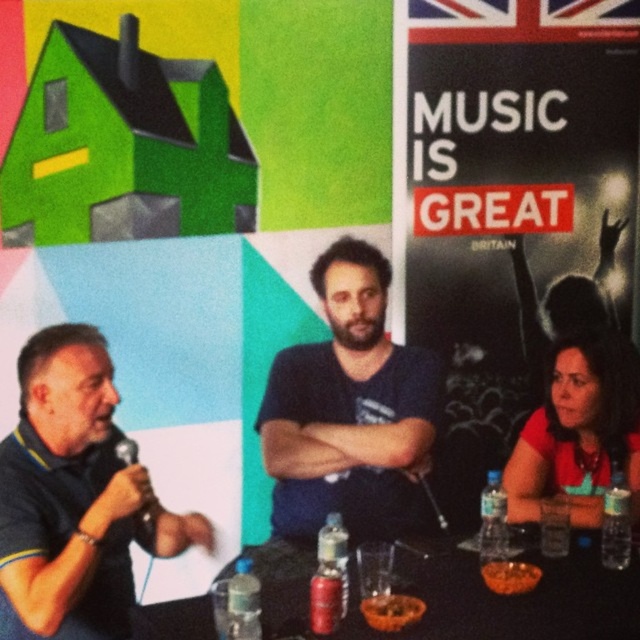
Is dark blue t-shirt at center bigger than black plastic table at lower center?

Yes, dark blue t-shirt at center is bigger than black plastic table at lower center.

Can you confirm if dark blue t-shirt at center is smaller than black plastic table at lower center?

Incorrect, dark blue t-shirt at center is not smaller in size than black plastic table at lower center.

In order to click on dark blue t-shirt at center in this screenshot , I will do `click(349, 410)`.

Identify the location of dark blue t-shirt at center. The image size is (640, 640). (349, 410).

Looking at this image, who is taller, matte blue polo shirt at left or matte red shirt at lower right?

matte blue polo shirt at left

Can you confirm if matte blue polo shirt at left is positioned below matte red shirt at lower right?

Yes, matte blue polo shirt at left is below matte red shirt at lower right.

Between point (81, 449) and point (577, 376), which one is positioned behind?

The point (577, 376) is behind.

This screenshot has width=640, height=640. I want to click on matte blue polo shirt at left, so click(74, 499).

Does matte blue polo shirt at left have a lesser width compared to black plastic table at lower center?

Yes, matte blue polo shirt at left is thinner than black plastic table at lower center.

Who is more forward, (13, 632) or (577, 612)?

Point (577, 612)

Find the location of a particular element. The image size is (640, 640). matte blue polo shirt at left is located at coordinates (74, 499).

Image resolution: width=640 pixels, height=640 pixels. Identify the location of matte blue polo shirt at left. (74, 499).